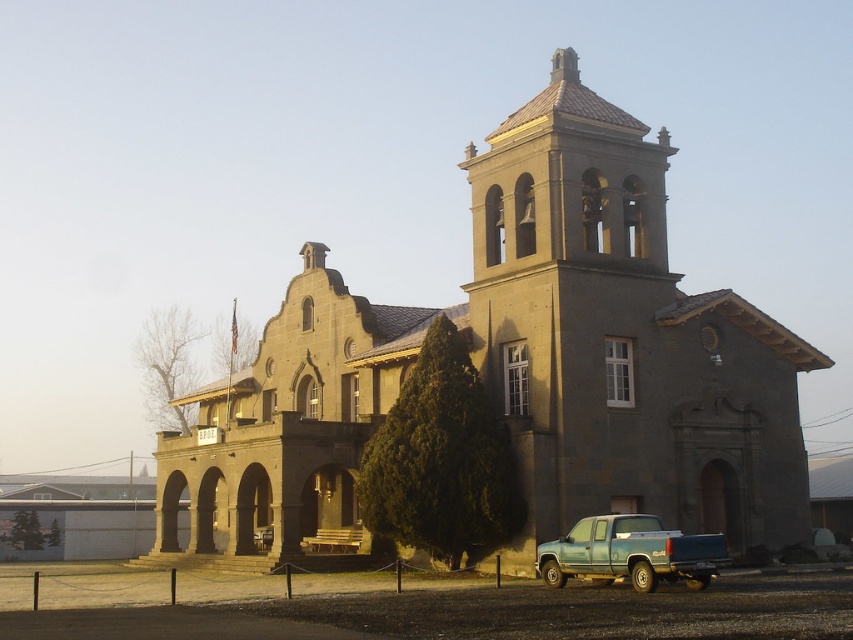
You are standing at a point 164.85 feet away from the point marked at coordinates point (613, 458). Can you see the bell tower on the right side of the historic building from your current position?

Yes, since you are 164.85 feet away from the point marked at coordinates point (613, 458), you can see the bell tower on the right side of the historic building from your current position.

You are a photographer positioned in front of the gray stone church at center. You want to take a photo of the teal matte truck at lower right without the church blocking the view. Is this possible?

The teal matte truck at lower right is behind the gray stone church at center, so it would be blocked from view. You cannot take a photo of the teal matte truck at lower right without the church blocking the view.

You are a delivery driver needing to park your teal matte truck at lower right as close as possible to the gray stone church at center without blocking the entrance. Given that the minimum safe distance required is 15 meters, can you park your truck closer than that?

The distance between the gray stone church at center and the teal matte truck at lower right is 15.16 meters, which is just over the minimum safe distance of 15 meters. Therefore, you can park the teal matte truck at lower right closer than 15 meters as long as it doesn not block the entrance.